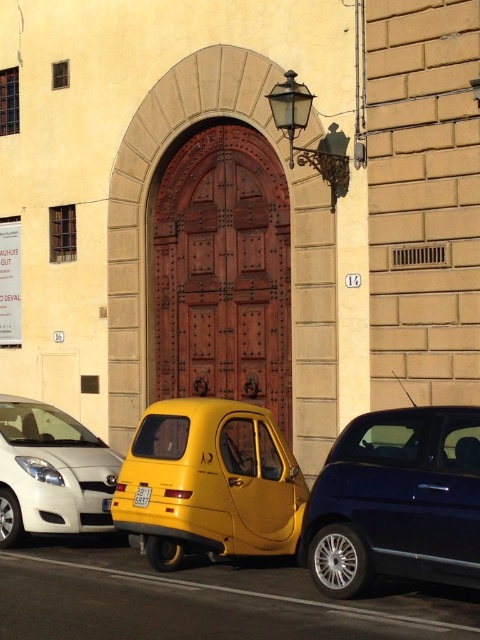
You are a pedestrian standing in front of the large ornate wooden door. You need to cross the street but must avoid the parked cars. Which car, the yellow matte taxi at center or the white glossy car at lower left, is directly in your path if you walk straight ahead?

The yellow matte taxi at center is directly in your path because it is positioned under the white glossy car at lower left, meaning it is closer to the door and directly ahead.

You are a delivery driver who needs to back out of the white car on the left and the yellow car with rounded body design. The yellow plastic license plate at center is between them. Can you safely back out without hitting the cars? Please explain.

The distance between the white car on the left and the yellow car with rounded body design is 7.84 meters. Since this distance is sufficient for a standard vehicle to maneuver backing out, you can safely back out without hitting the cars.